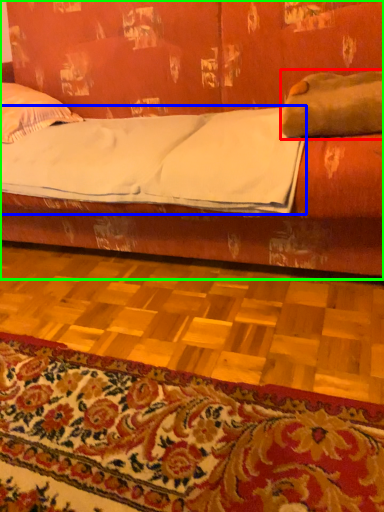
Question: Which object is the closest to the pillow (highlighted by a red box)? Choose among these: sheet (highlighted by a blue box) or studio couch (highlighted by a green box).

Choices:
 (A) sheet
 (B) studio couch

Answer: (A)